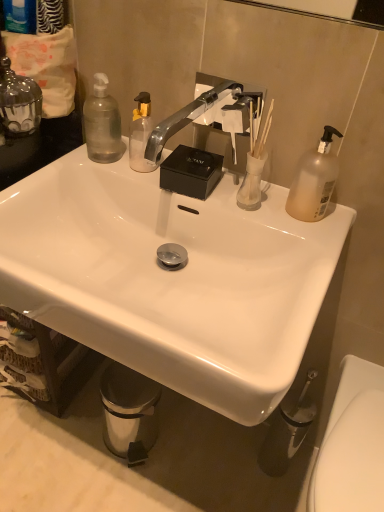
Where is `clear glass candle at upper left, positioned as the 3th bottle in right-to-left order`? clear glass candle at upper left, positioned as the 3th bottle in right-to-left order is located at coordinates (19, 102).

The height and width of the screenshot is (512, 384). Describe the element at coordinates (19, 102) in the screenshot. I see `clear glass candle at upper left, the first bottle from the left` at that location.

Measure the distance between point (167,132) and camera.

36.26 inches.

Measure the distance between white glossy sink at center and camera.

The distance of white glossy sink at center from camera is 20.51 inches.

Describe the element at coordinates (129, 412) in the screenshot. I see `metallic silver trash can at lower left` at that location.

Where is `transparent plastic bottle at upper left, arranged as the 2th bottle when viewed from the left`? transparent plastic bottle at upper left, arranged as the 2th bottle when viewed from the left is located at coordinates click(102, 123).

This screenshot has width=384, height=512. What are the coordinates of `clear glass candle at upper left, positioned as the 3th bottle in right-to-left order` in the screenshot? It's located at (19, 102).

Is translucent glass vase at upper right smaller than silver metallic faucet at center?

Indeed, translucent glass vase at upper right has a smaller size compared to silver metallic faucet at center.

Are translucent glass vase at upper right and silver metallic faucet at center making contact?

No, translucent glass vase at upper right is not next to silver metallic faucet at center.

Is translucent glass vase at upper right not within silver metallic faucet at center?

Yes, translucent glass vase at upper right is not within silver metallic faucet at center.

From the image's perspective, is translucent glass vase at upper right positioned above or below silver metallic faucet at center?

Clearly, from the image's perspective, translucent glass vase at upper right is below silver metallic faucet at center.

Is metallic silver trash can at lower left at the back of white glossy toilet at lower right?

white glossy toilet at lower right is not turned away from metallic silver trash can at lower left.

Which is in front, point (331, 429) or point (155, 428)?

The point (331, 429) is in front.

Can you confirm if white glossy toilet at lower right is shorter than metallic silver trash can at lower left?

Incorrect, the height of white glossy toilet at lower right does not fall short of that of metallic silver trash can at lower left.

Is white glossy toilet at lower right bigger than metallic silver trash can at lower left?

Indeed, white glossy toilet at lower right has a larger size compared to metallic silver trash can at lower left.

Can silver metallic faucet at center be found inside white glossy sink at center?

Definitely not — silver metallic faucet at center is not inside white glossy sink at center.

Does point (144, 318) appear closer or farther from the camera than point (154, 144)?

Point (144, 318).

Does white glossy sink at center have a greater width compared to silver metallic faucet at center?

Incorrect, the width of white glossy sink at center does not surpass that of silver metallic faucet at center.

Relative to white glossy sink at center, is clear glass candle at upper left, positioned as the 3th bottle in right-to-left order, in front or behind?

clear glass candle at upper left, positioned as the 3th bottle in right-to-left order, is positioned farther from the viewer than white glossy sink at center.

At what (x,y) coordinates should I click in order to perform the action: click on sink on the right side of clear glass candle at upper left, positioned as the 3th bottle in right-to-left order. Please return your answer as a coordinate pair (x, y). The image size is (384, 512). Looking at the image, I should click on (170, 278).

Can you confirm if clear glass candle at upper left, the first bottle from the left, is bigger than white glossy sink at center?

No, clear glass candle at upper left, the first bottle from the left, is not bigger than white glossy sink at center.

Does translucent glass vase at upper right have a greater width compared to metallic silver trash can at lower left?

In fact, translucent glass vase at upper right might be narrower than metallic silver trash can at lower left.

Locate an element on the screen. This screenshot has height=512, width=384. toiletries in front of the metallic silver trash can at lower left is located at coordinates (251, 183).

From the picture: Does translucent glass vase at upper right have a greater height compared to metallic silver trash can at lower left?

No, translucent glass vase at upper right is not taller than metallic silver trash can at lower left.

Between point (256, 191) and point (145, 399), which one is positioned behind?

Positioned behind is point (145, 399).

Would you say white glossy sink at center is inside or outside transparent plastic bottle at upper left, arranged as the 2th bottle when viewed from the left?

white glossy sink at center lies outside transparent plastic bottle at upper left, arranged as the 2th bottle when viewed from the left.

Based on the photo, which is closer, [218,346] or [110,97]?

Point [218,346]

Considering the relative positions of white glossy sink at center and transparent plastic bottle at upper left, arranged as the 2th bottle when viewed from the left, in the image provided, is white glossy sink at center to the left of transparent plastic bottle at upper left, arranged as the 2th bottle when viewed from the left, from the viewer's perspective?

In fact, white glossy sink at center is to the right of transparent plastic bottle at upper left, arranged as the 2th bottle when viewed from the left.

Are white glossy sink at center and transparent plastic bottle at upper left, arranged as the 2th bottle when viewed from the left, far apart?

That's not correct — white glossy sink at center is a little close to transparent plastic bottle at upper left, arranged as the 2th bottle when viewed from the left.

Considering the relative sizes of white glossy toilet at lower right and clear glass candle at upper left, the first bottle from the left, in the image provided, is white glossy toilet at lower right bigger than clear glass candle at upper left, the first bottle from the left,?

Correct, white glossy toilet at lower right is larger in size than clear glass candle at upper left, the first bottle from the left.

Considering the sizes of objects white glossy toilet at lower right and clear glass candle at upper left, the first bottle from the left, in the image provided, who is shorter, white glossy toilet at lower right or clear glass candle at upper left, the first bottle from the left,?

clear glass candle at upper left, the first bottle from the left.

Is point (367, 391) positioned behind point (14, 74)?

Yes, point (367, 391) is behind point (14, 74).

Does white glossy toilet at lower right appear on the right side of clear glass candle at upper left, positioned as the 3th bottle in right-to-left order?

Indeed, white glossy toilet at lower right is positioned on the right side of clear glass candle at upper left, positioned as the 3th bottle in right-to-left order.

Locate an element on the screen. The image size is (384, 512). toiletries lying below the silver metallic faucet at center (from the image's perspective) is located at coordinates (251, 183).

Identify the location of toilet on the right side of metallic silver trash can at lower left. The height and width of the screenshot is (512, 384). (352, 444).

Estimate the real-world distances between objects in this image. Which object is further from white glossy toilet at lower right, silver metallic faucet at center or metallic silver trash can at lower left?

Based on the image, silver metallic faucet at center appears to be further to white glossy toilet at lower right.

Which object lies nearer to the anchor point translucent plastic pump bottle at upper right, the 3th bottle in the left-to-right sequence, silver metallic faucet at center or translucent glass vase at upper right?

Among the two, translucent glass vase at upper right is located nearer to translucent plastic pump bottle at upper right, the 3th bottle in the left-to-right sequence.

Considering their positions, is transparent plastic bottle at upper left, acting as the 2th bottle starting from the right, positioned closer to clear glass candle at upper left, the first bottle from the left, than metallic silver trash can at lower left?

transparent plastic bottle at upper left, acting as the 2th bottle starting from the right, is positioned closer to the anchor clear glass candle at upper left, the first bottle from the left.

Estimate the real-world distances between objects in this image. Which object is closer to metallic silver trash can at lower left, translucent plastic pump bottle at upper right, the 3th bottle in the left-to-right sequence, or clear glass candle at upper left, positioned as the 3th bottle in right-to-left order?

Among the two, translucent plastic pump bottle at upper right, the 3th bottle in the left-to-right sequence, is located nearer to metallic silver trash can at lower left.

From the image, which object appears to be farther from metallic silver trash can at lower left, transparent plastic bottle at upper left, arranged as the 2th bottle when viewed from the left, or white glossy toilet at lower right?

transparent plastic bottle at upper left, arranged as the 2th bottle when viewed from the left, is further to metallic silver trash can at lower left.

Looking at the image, which one is located further to translucent plastic pump bottle at upper right, the 3th bottle in the left-to-right sequence, white glossy toilet at lower right or white glossy sink at center?

white glossy toilet at lower right is positioned further to the anchor translucent plastic pump bottle at upper right, the 3th bottle in the left-to-right sequence.

Based on their spatial positions, is translucent plastic pump bottle at upper right, acting as the 1th bottle starting from the right, or clear glass candle at upper left, positioned as the 3th bottle in right-to-left order, further from white glossy sink at center?

Based on the image, clear glass candle at upper left, positioned as the 3th bottle in right-to-left order, appears to be further to white glossy sink at center.

Based on the photo, considering their positions, is white glossy toilet at lower right positioned further to transparent plastic bottle at upper left, acting as the 2th bottle starting from the right, than silver metallic faucet at center?

white glossy toilet at lower right is positioned further to the anchor transparent plastic bottle at upper left, acting as the 2th bottle starting from the right.

Locate an element on the screen. trash bin/can between silver metallic faucet at center and white glossy toilet at lower right in the up-down direction is located at coordinates [129, 412].

This screenshot has width=384, height=512. Identify the location of bottle that lies between silver metallic faucet at center and metallic silver trash can at lower left from top to bottom. (314, 180).

Where is `toiletries between translucent plastic pump bottle at upper right, acting as the 1th bottle starting from the right, and metallic silver trash can at lower left in the up-down direction`? toiletries between translucent plastic pump bottle at upper right, acting as the 1th bottle starting from the right, and metallic silver trash can at lower left in the up-down direction is located at coordinates tap(251, 183).

Identify the location of sink between translucent glass vase at upper right and white glossy toilet at lower right vertically. (170, 278).